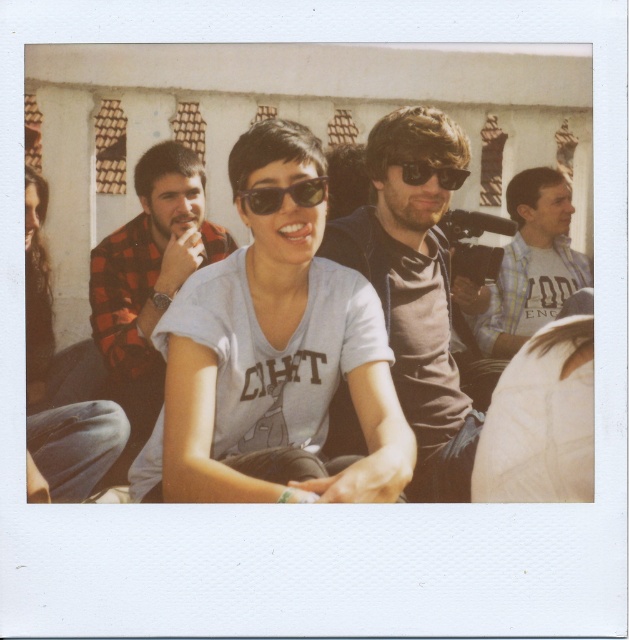
Question: Where is flannel shirt at center located in relation to white cotton shirt at right in the image?

Choices:
 (A) left
 (B) right

Answer: (A)

Question: Is matte brown shirt at center further to the viewer compared to white cotton shirt at right?

Choices:
 (A) no
 (B) yes

Answer: (A)

Question: Which is farther from the matte plaid shirt at left?

Choices:
 (A) white matte shirt at center
 (B) matte black sunglasses at center
 (C) white cotton shirt at right

Answer: (C)

Question: Considering the real-world distances, which object is closest to the white matte shirt at center?

Choices:
 (A) matte plaid shirt at left
 (B) sunglasses at center

Answer: (A)

Question: Which point appears closest to the camera in this image?

Choices:
 (A) (159, 177)
 (B) (221, 410)

Answer: (B)

Question: Is white matte shirt at center positioned at the back of matte black sunglasses at center?

Choices:
 (A) no
 (B) yes

Answer: (A)